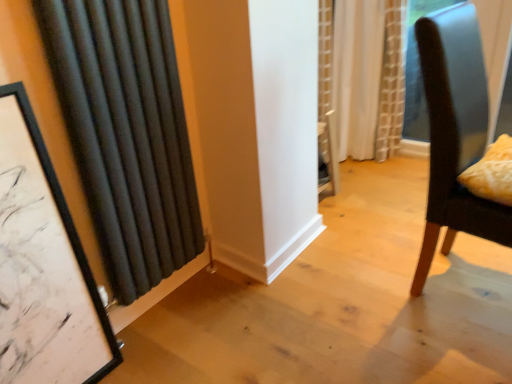
Question: Is white textured curtain at center, positioned as the second curtain in left-to-right order, positioned beyond the bounds of yellow textured pillow at right?

Choices:
 (A) yes
 (B) no

Answer: (A)

Question: Can you confirm if white textured curtain at center, which is the 1th curtain from right to left, is shorter than yellow textured pillow at right?

Choices:
 (A) no
 (B) yes

Answer: (A)

Question: Is white textured curtain at center, which is the 1th curtain from right to left, closer to the viewer compared to yellow textured pillow at right?

Choices:
 (A) no
 (B) yes

Answer: (A)

Question: Considering the relative sizes of white textured curtain at center, which is the 1th curtain in back-to-front order, and yellow textured pillow at right in the image provided, is white textured curtain at center, which is the 1th curtain in back-to-front order, smaller than yellow textured pillow at right?

Choices:
 (A) no
 (B) yes

Answer: (A)

Question: Could you tell me if white textured curtain at center, acting as the second curtain starting from the front, is facing yellow textured pillow at right?

Choices:
 (A) no
 (B) yes

Answer: (A)

Question: Based on their positions, is matte black picture frame at left located to the left or right of white textured curtain at center, which is the 1th curtain in back-to-front order?

Choices:
 (A) right
 (B) left

Answer: (B)

Question: Is matte black picture frame at left in front of or behind white textured curtain at center, which is the 1th curtain from right to left, in the image?

Choices:
 (A) front
 (B) behind

Answer: (A)

Question: From the image's perspective, is matte black picture frame at left positioned above or below white textured curtain at center, which is the 1th curtain in back-to-front order?

Choices:
 (A) above
 (B) below

Answer: (B)

Question: Is point [58, 360] closer or farther from the camera than point [368, 94]?

Choices:
 (A) closer
 (B) farther

Answer: (A)

Question: Would you say black fabric curtain at left, which ranks as the second curtain in back-to-front order, is to the left or to the right of yellow textured pillow at right in the picture?

Choices:
 (A) left
 (B) right

Answer: (A)

Question: Relative to yellow textured pillow at right, is black fabric curtain at left, acting as the 1th curtain starting from the front, in front or behind?

Choices:
 (A) front
 (B) behind

Answer: (A)

Question: Is point (160, 139) positioned closer to the camera than point (490, 188)?

Choices:
 (A) farther
 (B) closer

Answer: (A)

Question: In terms of width, does black fabric curtain at left, which ranks as the first curtain in left-to-right order, look wider or thinner when compared to yellow textured pillow at right?

Choices:
 (A) thin
 (B) wide

Answer: (A)

Question: Considering the positions of yellow textured pillow at right and matte black picture frame at left in the image, is yellow textured pillow at right taller or shorter than matte black picture frame at left?

Choices:
 (A) tall
 (B) short

Answer: (B)

Question: From the image's perspective, relative to matte black picture frame at left, is yellow textured pillow at right above or below?

Choices:
 (A) above
 (B) below

Answer: (A)